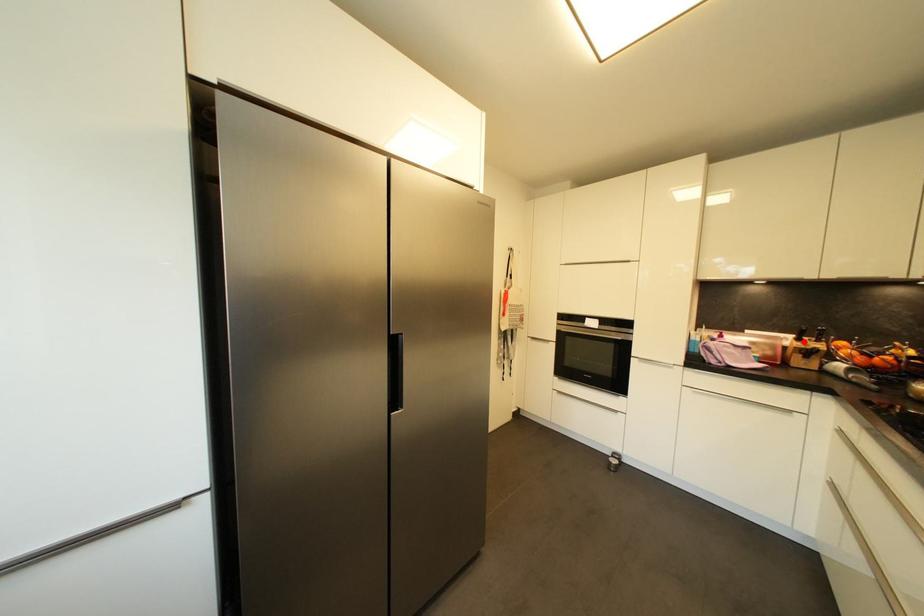
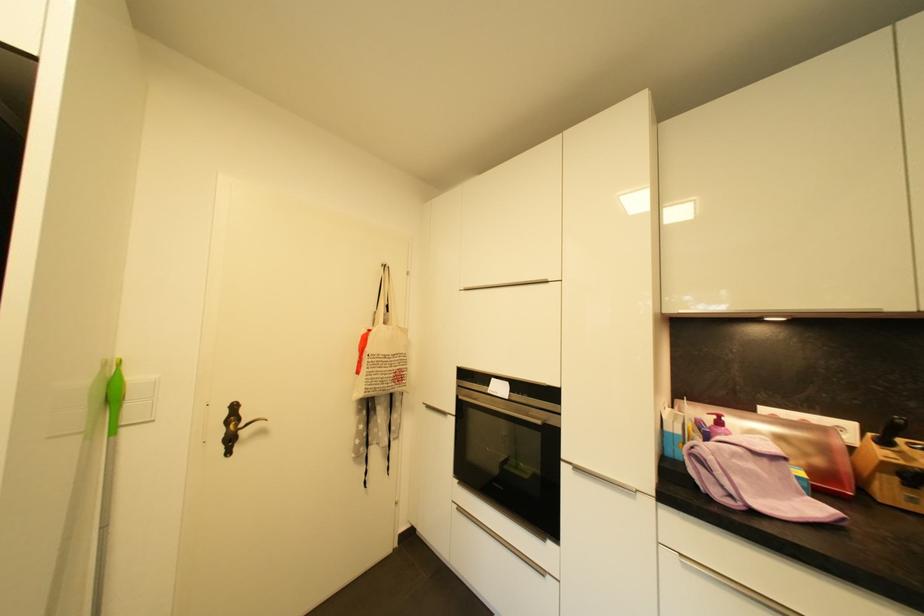
The point at the highlighted location is marked in the first image. Where is the corresponding point in the second image?

(890, 445)